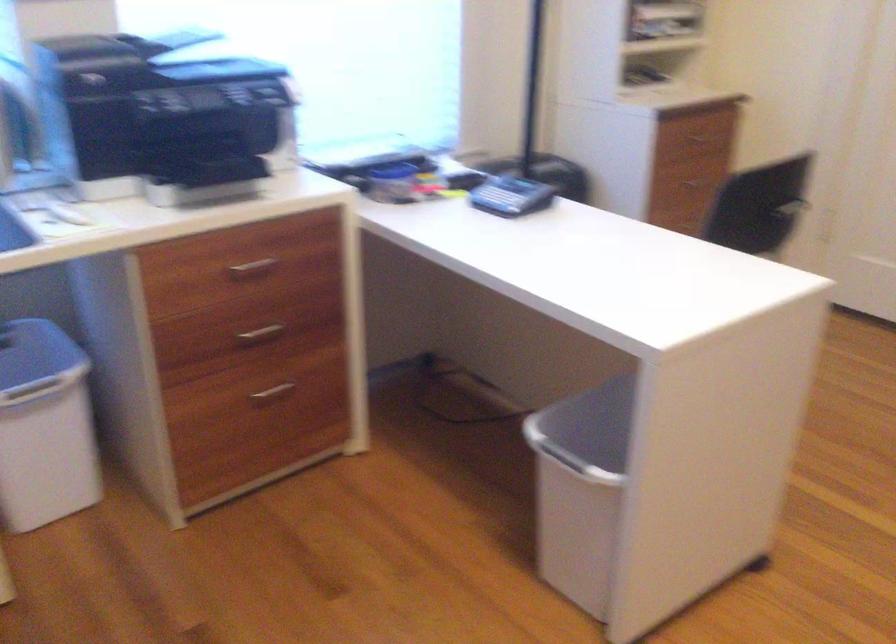
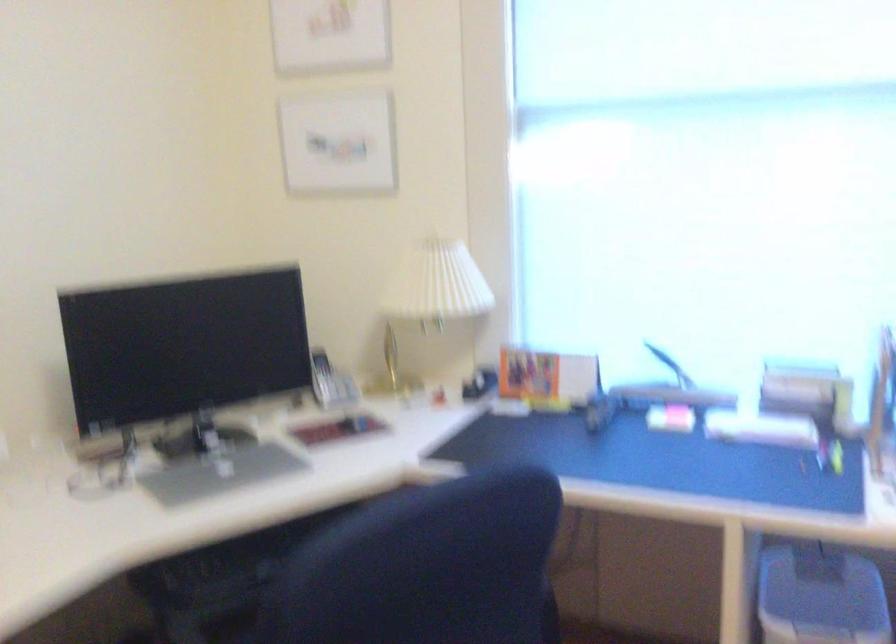
Question: The camera is either moving clockwise (left) or counter-clockwise (right) around the object. The first image is from the beginning of the video and the second image is from the end. Is the camera moving left or right when shooting the video?

Choices:
 (A) Left
 (B) Right

Answer: (B)